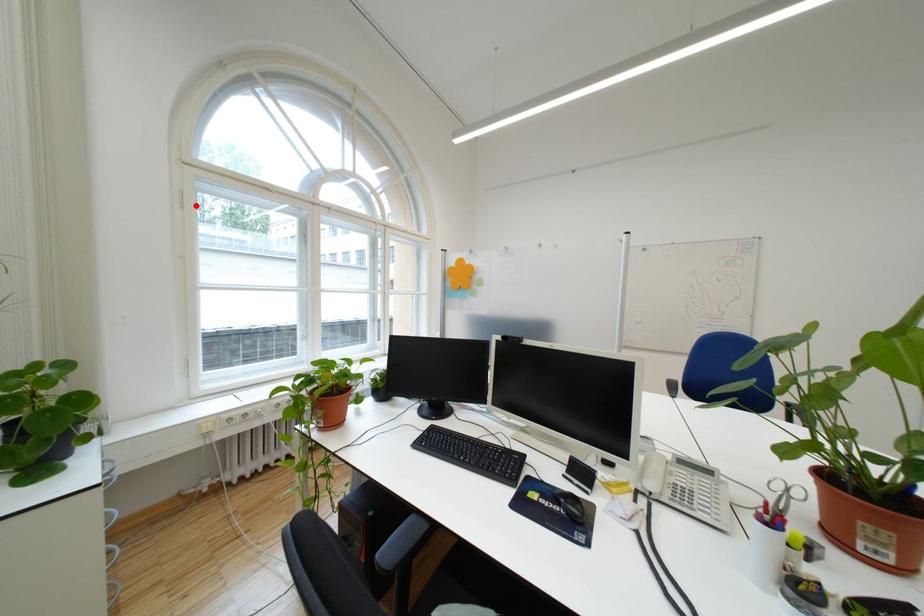
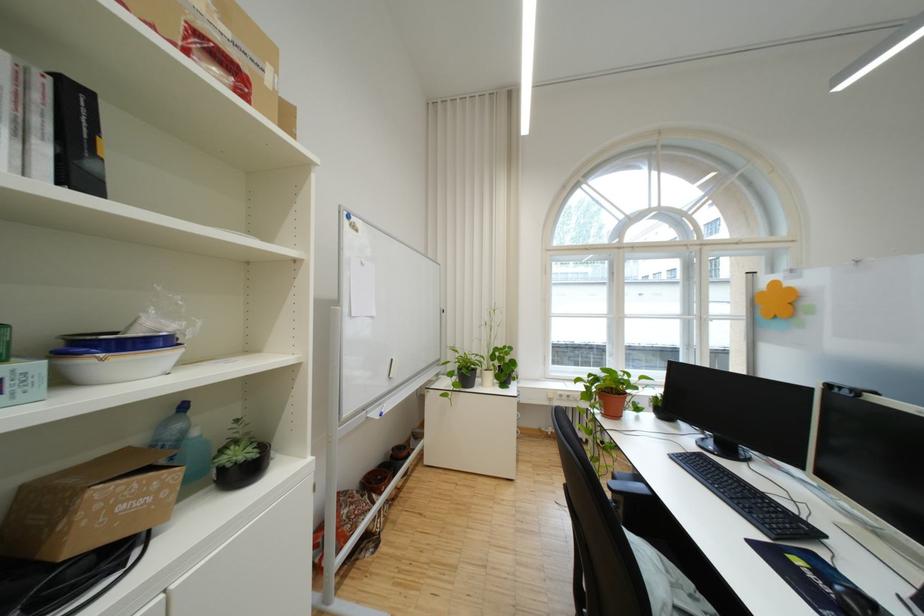
Find the pixel in the second image that matches the highlighted location in the first image.

(558, 273)